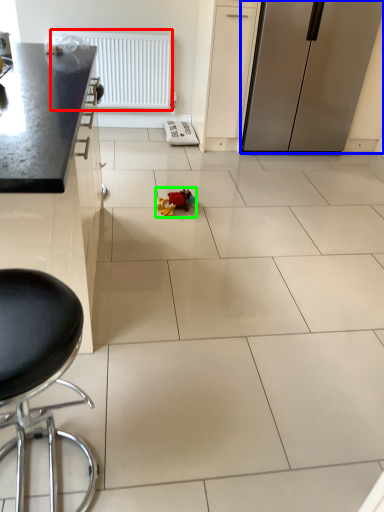
Question: Which is farther away from radiator (highlighted by a red box)? refrigerator (highlighted by a blue box) or toy (highlighted by a green box)?

Choices:
 (A) refrigerator
 (B) toy

Answer: (B)